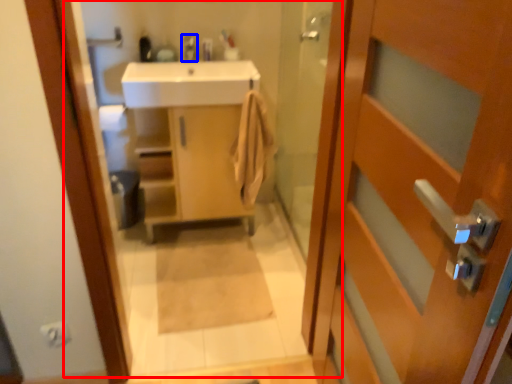
Question: Among these objects, which one is farthest to the camera, mirror (highlighted by a red box) or tap (highlighted by a blue box)?

Choices:
 (A) mirror
 (B) tap

Answer: (B)